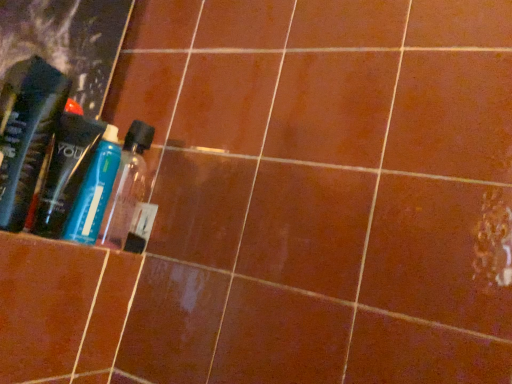
Question: Is transparent plastic bottle at center, which ranks as the first bottle in back-to-front order, at the back of translucent plastic bottle at left, marked as the second bottle in a back-to-front arrangement?

Choices:
 (A) yes
 (B) no

Answer: (A)

Question: From a real-world perspective, is translucent plastic bottle at left, marked as the second bottle in a back-to-front arrangement, under transparent plastic bottle at center, which ranks as the first bottle in back-to-front order?

Choices:
 (A) no
 (B) yes

Answer: (A)

Question: Considering the relative positions of translucent plastic bottle at left, marked as the second bottle in a back-to-front arrangement, and transparent plastic bottle at center, which ranks as the first bottle in back-to-front order, in the image provided, is translucent plastic bottle at left, marked as the second bottle in a back-to-front arrangement, to the left of transparent plastic bottle at center, which ranks as the first bottle in back-to-front order, from the viewer's perspective?

Choices:
 (A) no
 (B) yes

Answer: (B)

Question: Are translucent plastic bottle at left, marked as the second bottle in a back-to-front arrangement, and transparent plastic bottle at center, the second bottle positioned from the front, far apart?

Choices:
 (A) yes
 (B) no

Answer: (B)

Question: Can you confirm if translucent plastic bottle at left, the first bottle from the front, is wider than transparent plastic bottle at center, which ranks as the first bottle in back-to-front order?

Choices:
 (A) yes
 (B) no

Answer: (A)

Question: From the image's perspective, is translucent plastic bottle at left, marked as the second bottle in a back-to-front arrangement, below transparent plastic bottle at center, which ranks as the first bottle in back-to-front order?

Choices:
 (A) no
 (B) yes

Answer: (A)

Question: Considering the relative positions of translucent plastic bottle at left and transparent plastic bottle at center, which ranks as the first bottle in back-to-front order, in the image provided, is translucent plastic bottle at left in front of transparent plastic bottle at center, which ranks as the first bottle in back-to-front order,?

Choices:
 (A) yes
 (B) no

Answer: (B)

Question: Is translucent plastic bottle at left taller than transparent plastic bottle at center, the second bottle positioned from the front?

Choices:
 (A) yes
 (B) no

Answer: (A)

Question: Is translucent plastic bottle at left not within transparent plastic bottle at center, which ranks as the first bottle in back-to-front order?

Choices:
 (A) no
 (B) yes

Answer: (B)

Question: From a real-world perspective, is translucent plastic bottle at left on top of transparent plastic bottle at center, the second bottle positioned from the front?

Choices:
 (A) no
 (B) yes

Answer: (B)

Question: Does translucent plastic bottle at left lie behind transparent plastic bottle at center, which ranks as the first bottle in back-to-front order?

Choices:
 (A) no
 (B) yes

Answer: (B)

Question: Is translucent plastic bottle at left positioned with its back to transparent plastic bottle at center, the second bottle positioned from the front?

Choices:
 (A) no
 (B) yes

Answer: (A)

Question: Is translucent plastic bottle at left at the back of translucent plastic bottle at left, the first bottle from the front?

Choices:
 (A) no
 (B) yes

Answer: (A)